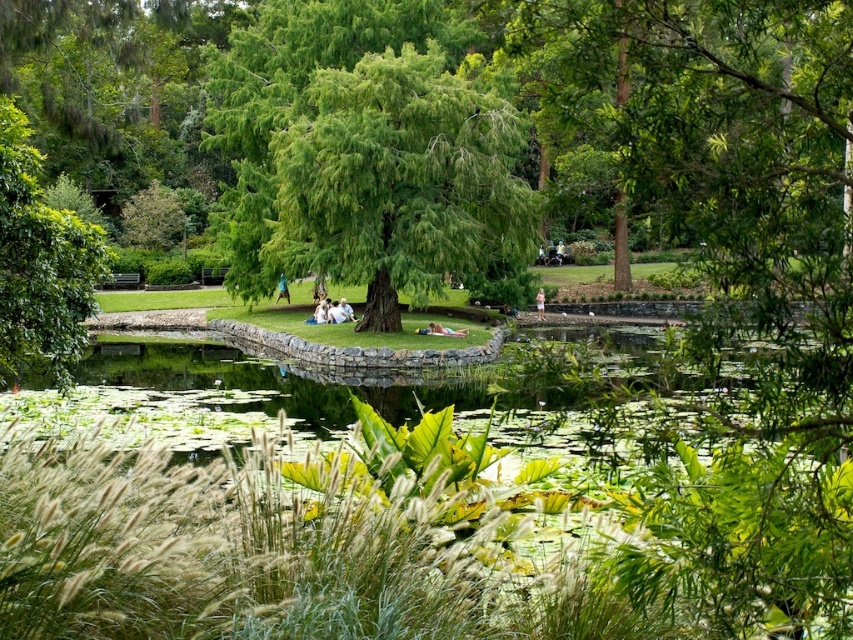
Is light brown wooden bench at center wider than pink fabric dress at center?

Yes, light brown wooden bench at center is wider than pink fabric dress at center.

The width and height of the screenshot is (853, 640). Find the location of `light brown wooden bench at center`. light brown wooden bench at center is located at coordinates (445, 330).

Where is `light brown wooden bench at center`? The height and width of the screenshot is (640, 853). light brown wooden bench at center is located at coordinates (445, 330).

Does green leafy tree at center have a lesser height compared to green leafy tree at left?

No, green leafy tree at center is not shorter than green leafy tree at left.

Between green leafy tree at center and green leafy tree at left, which one is positioned lower?

green leafy tree at left is lower down.

Which is behind, point (341, 80) or point (4, 376)?

Point (341, 80)

What are the coordinates of `green leafy tree at center` in the screenshot? It's located at (399, 180).

Locate an element on the screen. light brown wooden bench at center is located at coordinates (445, 330).

Who is more forward, (427,326) or (279,284)?

Positioned in front is point (427,326).

Does point (437, 330) lie behind point (282, 285)?

That is False.

Find the location of a particular element. Image resolution: width=853 pixels, height=640 pixels. light brown wooden bench at center is located at coordinates (445, 330).